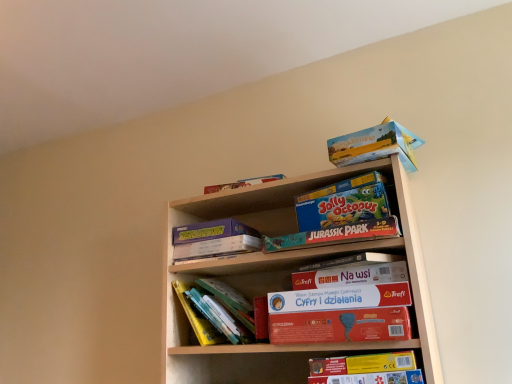
Question: Is red matte board game at center, acting as the 1th paperback book starting from the bottom, to the left or to the right of yellow cardboard book at lower right, marked as the second book in a back-to-front arrangement, in the image?

Choices:
 (A) left
 (B) right

Answer: (A)

Question: From the image's perspective, relative to yellow cardboard book at lower right, acting as the first book starting from the front, is red matte board game at center, acting as the 1th paperback book starting from the bottom, above or below?

Choices:
 (A) above
 (B) below

Answer: (A)

Question: Considering the real-world distances, which object is farthest from the blue cardboard jolly octopus board game at center, the first paperback book in the top-to-bottom sequence?

Choices:
 (A) teal matte jurassic park puzzle at center, which ranks as the fourth paperback book in bottom-to-top order
 (B) matte purple book at upper center, positioned as the 3th paperback book in top-to-bottom order
 (C) yellow cardboard book at lower right, placed as the first book when sorted from right to left
 (D) hardcover books at center, the first book positioned from the back
 (E) red matte board game at center, acting as the 1th paperback book starting from the bottom

Answer: (D)

Question: Which object is positioned farthest from the hardcover books at center, the first book positioned from the back?

Choices:
 (A) yellow cardboard book at lower right, acting as the first book starting from the front
 (B) matte purple book at upper center, marked as the 3th paperback book in a bottom-to-top arrangement
 (C) blue cardboard jolly octopus board game at center, the first paperback book in the top-to-bottom sequence
 (D) white matte paperback book at center, placed as the 2th paperback book when sorted from bottom to top
 (E) matte cardboard box at upper right

Answer: (E)